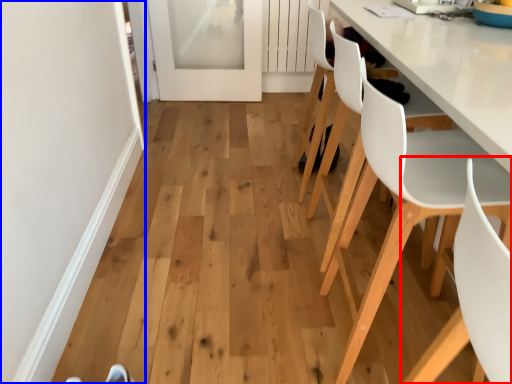
Question: Which object is closer to the camera taking this photo, chair (highlighted by a red box) or door (highlighted by a blue box)?

Choices:
 (A) chair
 (B) door

Answer: (A)